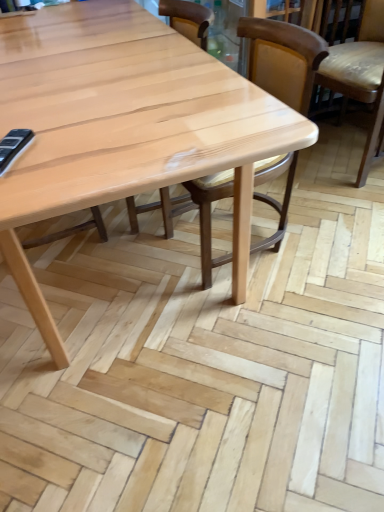
Question: In the image, is natural wood chair at center, which is the first chair in left-to-right order, positioned in front of or behind wooden chair at center, acting as the 2th chair starting from the left?

Choices:
 (A) front
 (B) behind

Answer: (B)

Question: From a real-world perspective, is natural wood chair at center, which is the 3th chair in right-to-left order, physically located above or below wooden chair at center, placed as the second chair when sorted from right to left?

Choices:
 (A) above
 (B) below

Answer: (A)

Question: Considering the real-world distances, which object is closest to the natural wood chair at center, which is the 3th chair in right-to-left order?

Choices:
 (A) light brown leather chair at right, which is the 3th chair in left-to-right order
 (B) wooden chair at center, placed as the second chair when sorted from right to left

Answer: (B)

Question: Which object is positioned farthest from the natural wood chair at center, which is the 3th chair in right-to-left order?

Choices:
 (A) light brown leather chair at right, arranged as the first chair when viewed from the right
 (B) wooden chair at center, placed as the second chair when sorted from right to left

Answer: (A)